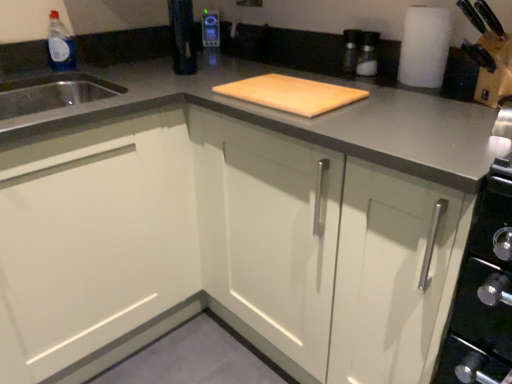
Question: Does white matte cabinet at center, marked as the first cabinetry in a right-to-left arrangement, have a greater width compared to white matte cabinet at left, the first cabinetry viewed from the left?

Choices:
 (A) no
 (B) yes

Answer: (A)

Question: Is white matte cabinet at center, marked as the first cabinetry in a right-to-left arrangement, in contact with white matte cabinet at left, the first cabinetry viewed from the left?

Choices:
 (A) yes
 (B) no

Answer: (B)

Question: Is white matte cabinet at center, marked as the first cabinetry in a right-to-left arrangement, at the right side of white matte cabinet at left, placed as the second cabinetry when sorted from right to left?

Choices:
 (A) yes
 (B) no

Answer: (A)

Question: From the image's perspective, is white matte cabinet at center, placed as the second cabinetry when sorted from left to right, under white matte cabinet at left, placed as the second cabinetry when sorted from right to left?

Choices:
 (A) yes
 (B) no

Answer: (B)

Question: Are white matte cabinet at center, marked as the first cabinetry in a right-to-left arrangement, and white matte cabinet at left, the first cabinetry viewed from the left, far apart?

Choices:
 (A) yes
 (B) no

Answer: (B)

Question: Relative to white matte paper towel at upper right, is natural wood cutting board at center in front or behind?

Choices:
 (A) behind
 (B) front

Answer: (B)

Question: Based on their sizes in the image, would you say natural wood cutting board at center is bigger or smaller than white matte paper towel at upper right?

Choices:
 (A) big
 (B) small

Answer: (A)

Question: Considering the relative positions of natural wood cutting board at center and white matte paper towel at upper right in the image provided, is natural wood cutting board at center to the left or to the right of white matte paper towel at upper right?

Choices:
 (A) right
 (B) left

Answer: (B)

Question: In terms of width, does natural wood cutting board at center look wider or thinner when compared to white matte paper towel at upper right?

Choices:
 (A) wide
 (B) thin

Answer: (A)

Question: Does point (344, 87) appear closer or farther from the camera than point (296, 286)?

Choices:
 (A) farther
 (B) closer

Answer: (A)

Question: From the image's perspective, is natural wood cutting board at center positioned above or below white matte cabinet at center, placed as the second cabinetry when sorted from left to right?

Choices:
 (A) above
 (B) below

Answer: (A)

Question: Do you think natural wood cutting board at center is within white matte cabinet at center, marked as the first cabinetry in a right-to-left arrangement, or outside of it?

Choices:
 (A) outside
 (B) inside

Answer: (B)

Question: Looking at the image, does natural wood cutting board at center seem bigger or smaller compared to white matte cabinet at center, placed as the second cabinetry when sorted from left to right?

Choices:
 (A) small
 (B) big

Answer: (A)

Question: Is white matte paper towel at upper right in front of or behind white matte cabinet at center, marked as the first cabinetry in a right-to-left arrangement, in the image?

Choices:
 (A) behind
 (B) front

Answer: (A)

Question: Looking at their shapes, would you say white matte paper towel at upper right is wider or thinner than white matte cabinet at center, marked as the first cabinetry in a right-to-left arrangement?

Choices:
 (A) thin
 (B) wide

Answer: (A)